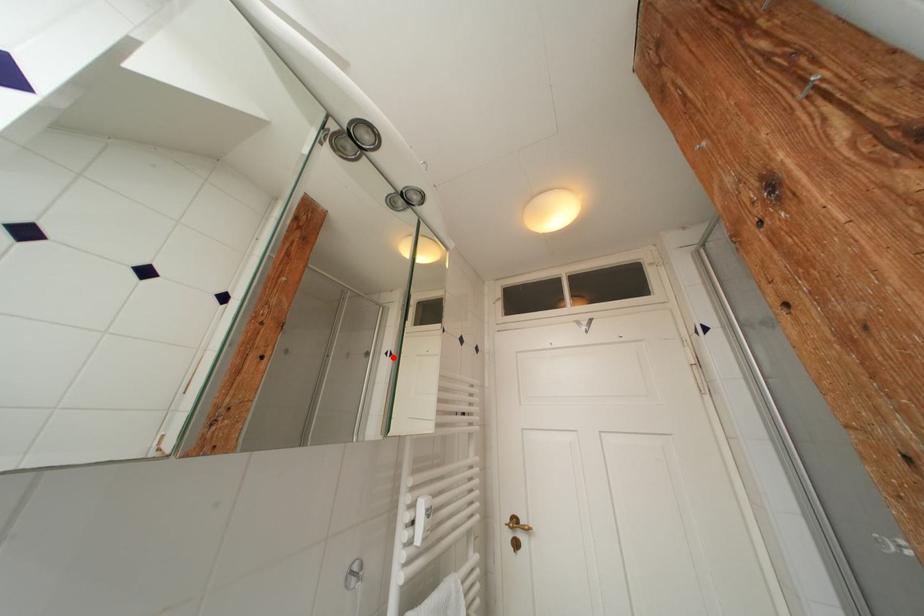
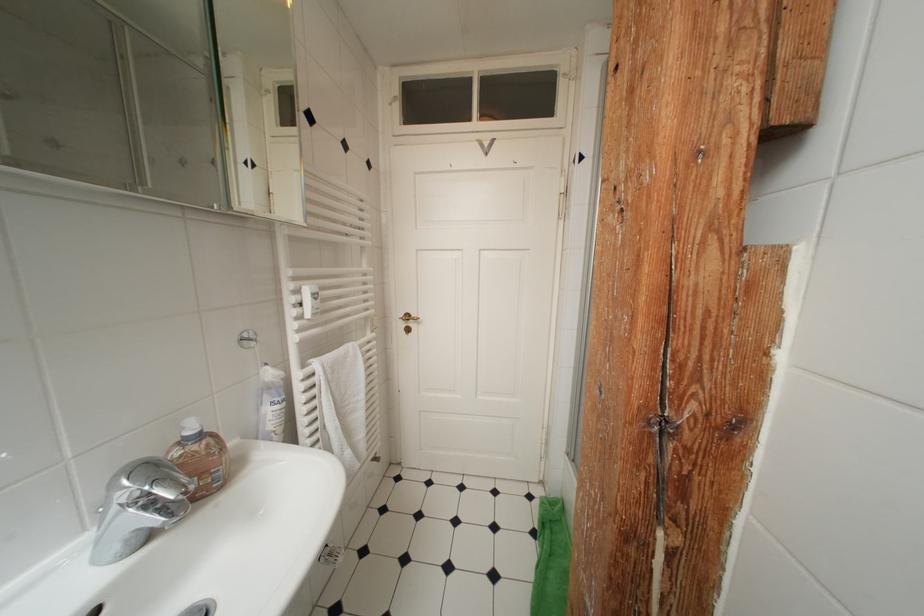
Question: A red point is marked in image1. In image2, is the corresponding 3D point closer to the camera or farther? Reply with the corresponding letter.

Choices:
 (A) The corresponding 3D point is closer.
 (B) The corresponding 3D point is farther.

Answer: (A)